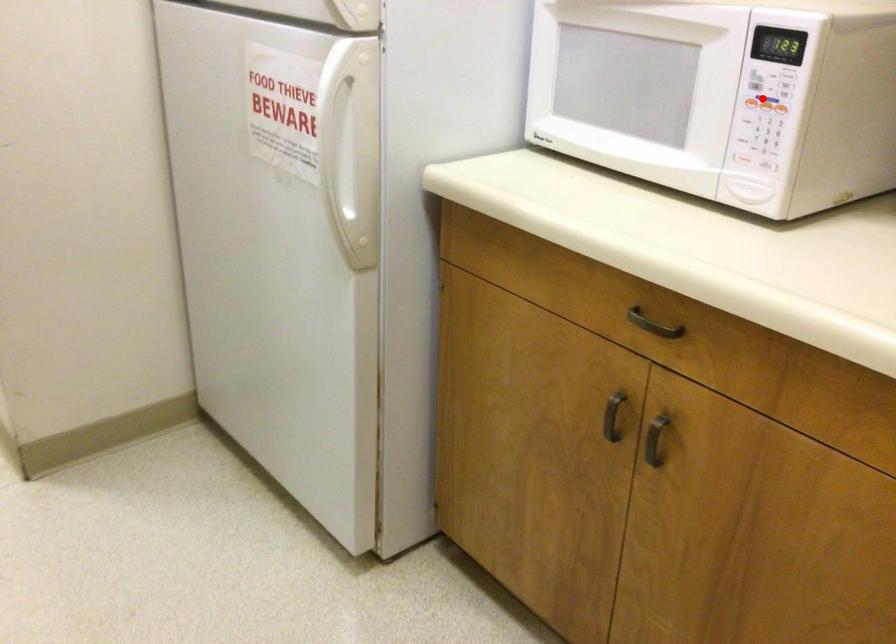
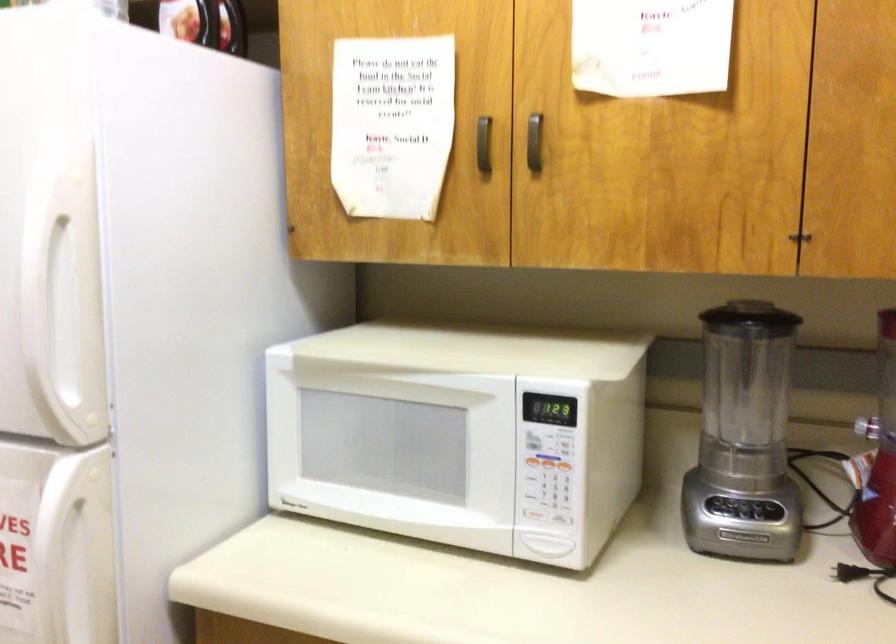
The point at the highlighted location is marked in the first image. Where is the corresponding point in the second image?

(547, 462)